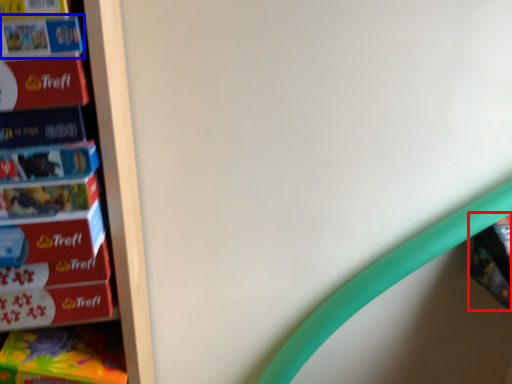
Question: Which point is further to the camera, book (highlighted by a red box) or book (highlighted by a blue box)?

Choices:
 (A) book
 (B) book

Answer: (A)